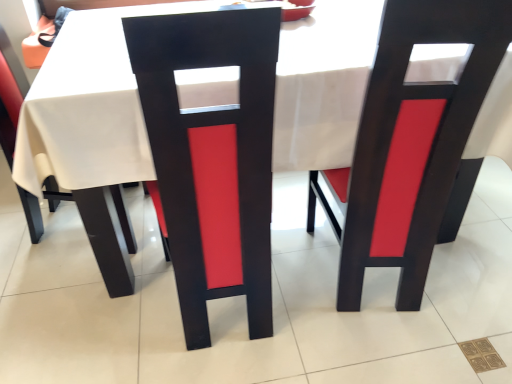
Question: Does matte black chair at center, acting as the second chair starting from the right, appear on the left side of matte black chair at center, which is the 3th chair from left to right?

Choices:
 (A) no
 (B) yes

Answer: (B)

Question: Is matte black chair at center, which is the 3th chair from left to right, located within matte black chair at center, positioned as the 2th chair in left-to-right order?

Choices:
 (A) yes
 (B) no

Answer: (B)

Question: From the image's perspective, is matte black chair at center, acting as the second chair starting from the right, above matte black chair at center, which is the 1th chair in right-to-left order?

Choices:
 (A) yes
 (B) no

Answer: (B)

Question: Is there a large distance between matte black chair at center, acting as the second chair starting from the right, and matte black chair at center, which is the 3th chair from left to right?

Choices:
 (A) yes
 (B) no

Answer: (B)

Question: From a real-world perspective, is matte black chair at center, positioned as the 2th chair in left-to-right order, beneath matte black chair at center, which is the 1th chair in right-to-left order?

Choices:
 (A) no
 (B) yes

Answer: (A)

Question: Is the depth of matte black chair at center, acting as the second chair starting from the right, greater than that of matte black chair at center, which is the 3th chair from left to right?

Choices:
 (A) yes
 (B) no

Answer: (B)

Question: Can you confirm if matte black chair at center, which is the 3th chair from left to right, is thinner than matte black chair at left, the third chair viewed from the right?

Choices:
 (A) no
 (B) yes

Answer: (B)

Question: Considering the relative sizes of matte black chair at center, which is the 1th chair in right-to-left order, and matte black chair at left, placed as the 1th chair when sorted from left to right, in the image provided, is matte black chair at center, which is the 1th chair in right-to-left order, taller than matte black chair at left, placed as the 1th chair when sorted from left to right,?

Choices:
 (A) yes
 (B) no

Answer: (A)

Question: Is matte black chair at center, which is the 3th chair from left to right, facing away from matte black chair at left, the third chair viewed from the right?

Choices:
 (A) yes
 (B) no

Answer: (B)

Question: Is matte black chair at left, the third chair viewed from the right, located within matte black chair at center, which is the 1th chair in right-to-left order?

Choices:
 (A) no
 (B) yes

Answer: (A)

Question: Is matte black chair at center, which is the 3th chair from left to right, positioned beyond the bounds of matte black chair at left, placed as the 1th chair when sorted from left to right?

Choices:
 (A) no
 (B) yes

Answer: (B)

Question: Considering the relative sizes of matte black chair at center, which is the 1th chair in right-to-left order, and matte black chair at left, the third chair viewed from the right, in the image provided, is matte black chair at center, which is the 1th chair in right-to-left order, smaller than matte black chair at left, the third chair viewed from the right,?

Choices:
 (A) no
 (B) yes

Answer: (A)

Question: Is matte black chair at left, the third chair viewed from the right, to the left of matte black chair at center, which is the 3th chair from left to right, from the viewer's perspective?

Choices:
 (A) no
 (B) yes

Answer: (B)